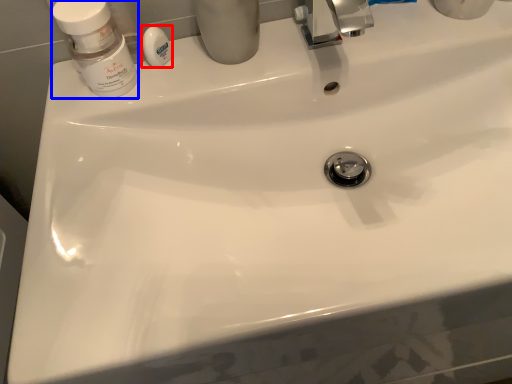
Question: Which of the following is the farthest to the observer, soap (highlighted by a red box) or mouthwash (highlighted by a blue box)?

Choices:
 (A) soap
 (B) mouthwash

Answer: (A)